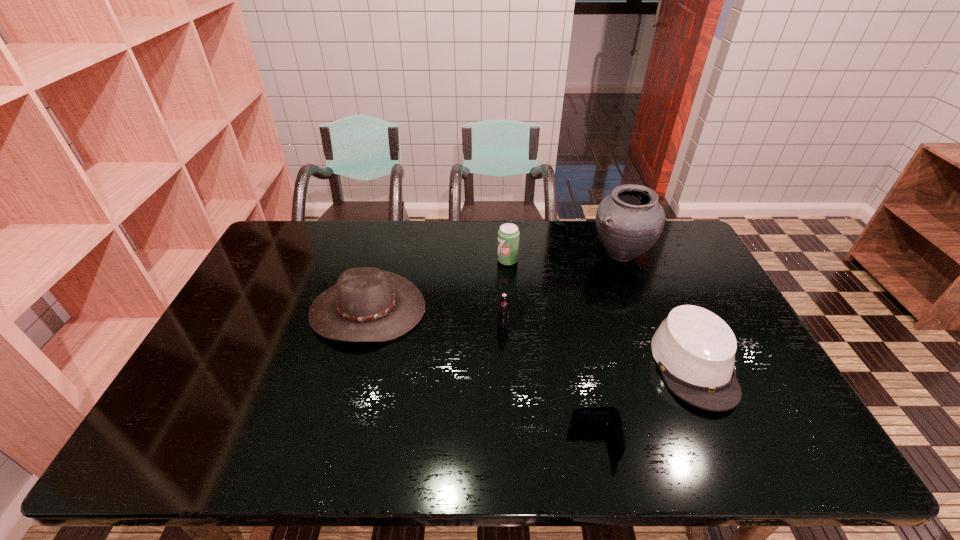
You are a GUI agent. You are given a task and a screenshot of the screen. Output one action in this format:
    pyautogui.click(x=<x>, y=<y>)
    Task: Click on the tallest object
    This screenshot has width=960, height=540.
    Given the screenshot: What is the action you would take?
    pyautogui.click(x=629, y=222)

Locate an element on the screen. This screenshot has height=540, width=960. the farther pop is located at coordinates (508, 235).

Where is `the left hat`? Image resolution: width=960 pixels, height=540 pixels. the left hat is located at coordinates (366, 305).

Where is `the nearer pop`? Image resolution: width=960 pixels, height=540 pixels. the nearer pop is located at coordinates (503, 309).

This screenshot has width=960, height=540. In order to click on the shorter hat in this screenshot , I will do [x=694, y=349].

Where is `wallet`? The image size is (960, 540). wallet is located at coordinates (590, 416).

Image resolution: width=960 pixels, height=540 pixels. What are the coordinates of `the nearest object` in the screenshot? It's located at (590, 416).

The width and height of the screenshot is (960, 540). I want to click on vacant space located 0.080m on the back of the urn, so click(x=609, y=224).

In order to click on vacant space located on the back of the farther pop in this screenshot , I will do `click(506, 239)`.

This screenshot has width=960, height=540. I want to click on free space located 0.230m on the front-facing side of the left hat, so click(338, 423).